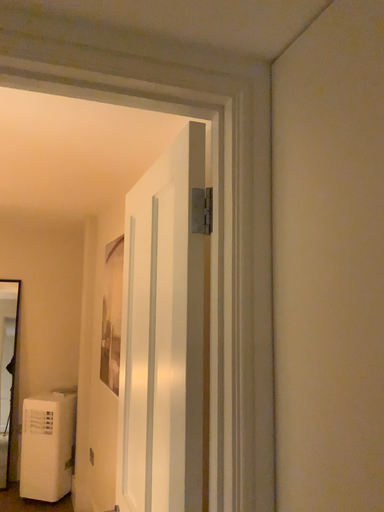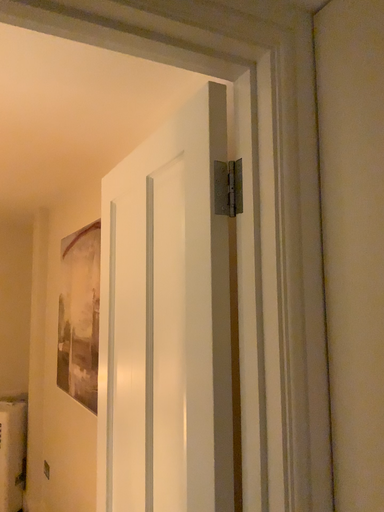
Question: Which way did the camera rotate in the video?

Choices:
 (A) rotated left
 (B) rotated right

Answer: (B)